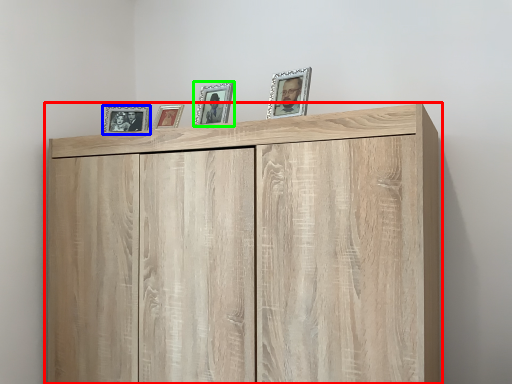
Question: Considering the real-world distances, which object is farthest from cupboard (highlighted by a red box)? picture frame (highlighted by a blue box) or picture frame (highlighted by a green box)?

Choices:
 (A) picture frame
 (B) picture frame

Answer: (A)